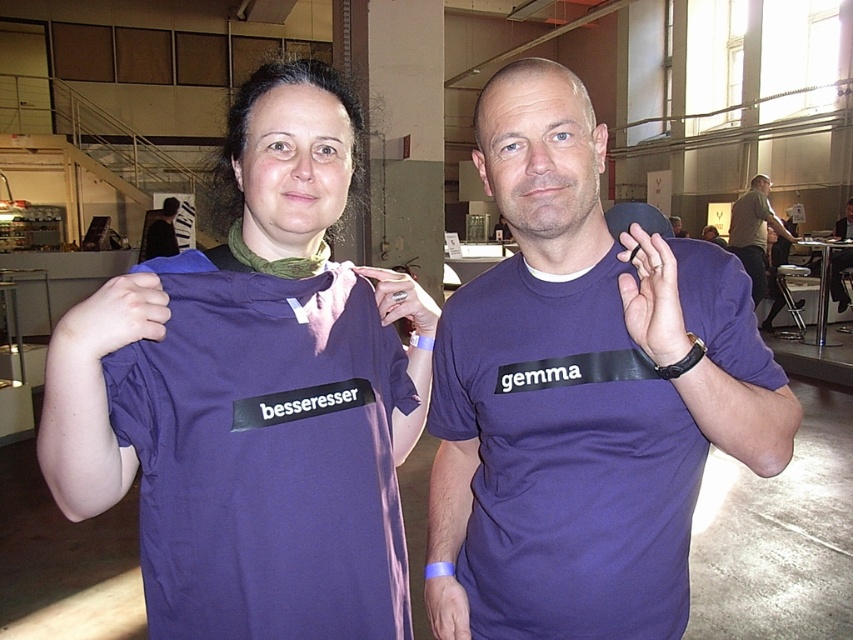
You are at an event and want to take a photo of both the point at location [169,205] and the point at [563,275]. To ensure both are in frame, which point should you position closer to the camera?

You should position the point at [563,275] closer to the camera because point [169,205] is behind it, so adjusting the closer point might help both remain in frame.